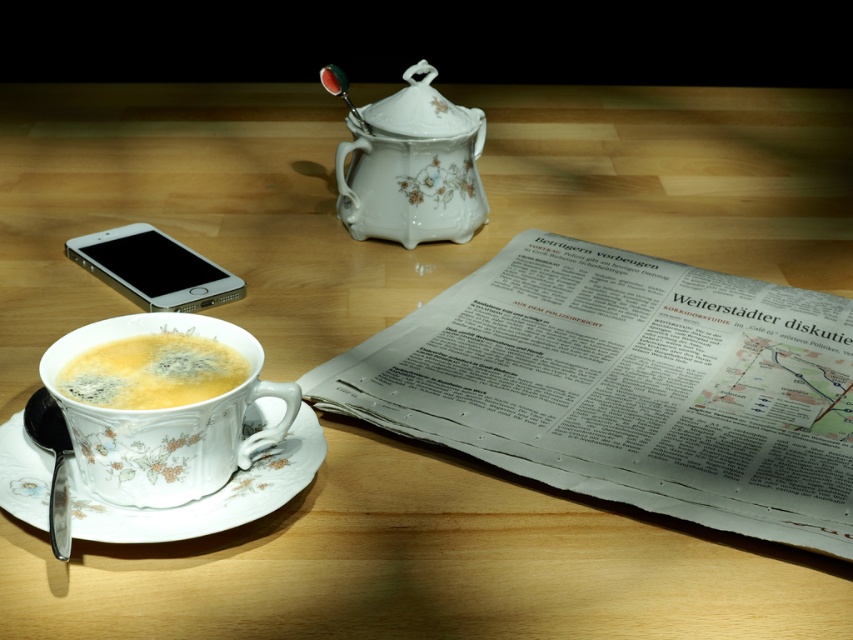
Question: Which point is farther to the camera?

Choices:
 (A) matte porcelain cup of tea at lower left
 (B) porcelain cup at lower left
 (C) white paper at center

Answer: (C)

Question: Can you confirm if porcelain cup at lower left is positioned above porcelain floral tea pot at center?

Choices:
 (A) yes
 (B) no

Answer: (B)

Question: Which is nearer to the silver metallic smartphone at lower left?

Choices:
 (A) porcelain cup at lower left
 (B) porcelain floral tea pot at center

Answer: (B)

Question: Does porcelain cup at lower left appear on the left side of porcelain saucer at lower left?

Choices:
 (A) no
 (B) yes

Answer: (A)

Question: Can you confirm if porcelain floral tea pot at center is bigger than matte porcelain cup of tea at lower left?

Choices:
 (A) no
 (B) yes

Answer: (B)

Question: Which point is closer to the camera?

Choices:
 (A) (297, 465)
 (B) (466, 234)
 (C) (247, 376)

Answer: (C)